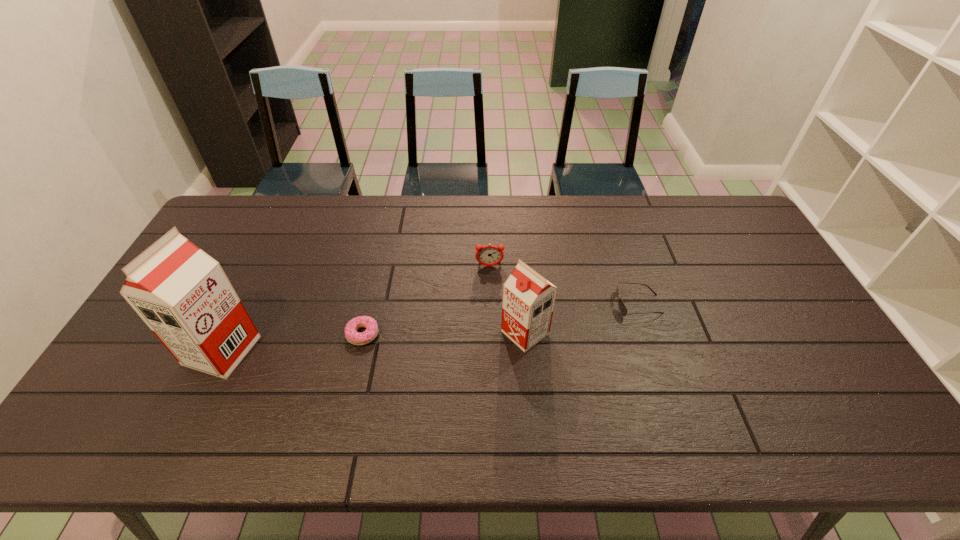
Please point out where to position a new soya milk on the right to maintain spacing. Please provide its 2D coordinates. Your answer should be formatted as a tuple, i.e. [(x, y)], where the tuple contains the x and y coordinates of a point satisfying the conditions above.

[(808, 316)]